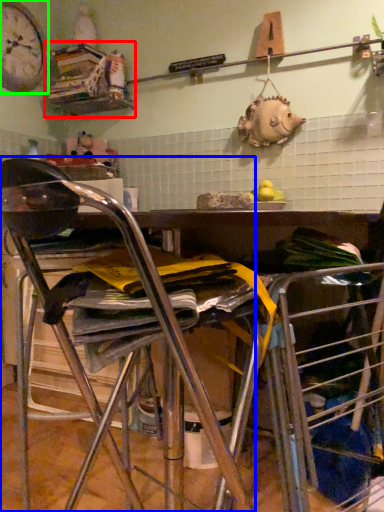
Question: Which object is positioned farthest from shelf (highlighted by a red box)? Select from chair (highlighted by a blue box) and clock (highlighted by a green box).

Choices:
 (A) chair
 (B) clock

Answer: (A)